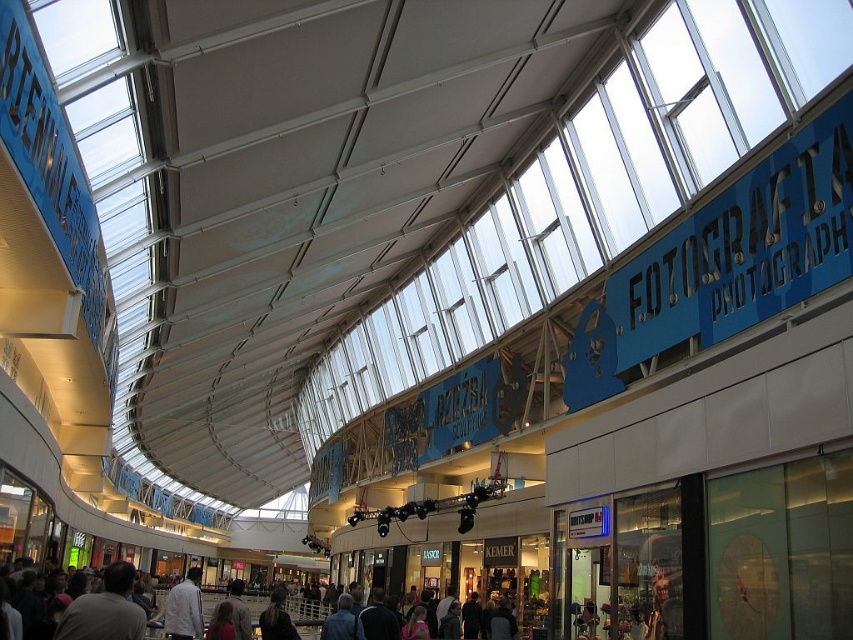
Looking at this image, how much distance is there between light brown leather jacket at center and white shirt at center?

They are 10.56 meters apart.

Does light brown leather jacket at center appear on the right side of white shirt at center?

Indeed, light brown leather jacket at center is positioned on the right side of white shirt at center.

The width and height of the screenshot is (853, 640). In order to click on light brown leather jacket at center in this screenshot , I will do tap(105, 609).

The width and height of the screenshot is (853, 640). Describe the element at coordinates (105, 609) in the screenshot. I see `light brown leather jacket at center` at that location.

Who is positioned more to the right, light brown leather jacket at center or dark brown leather jacket at center?

light brown leather jacket at center is more to the right.

The width and height of the screenshot is (853, 640). I want to click on light brown leather jacket at center, so click(x=105, y=609).

Where is `light brown leather jacket at center`? light brown leather jacket at center is located at coordinates (105, 609).

Is point (164, 609) farther from camera compared to point (270, 602)?

That is False.

Does white shirt at center appear on the right side of dark brown leather jacket at center?

In fact, white shirt at center is to the left of dark brown leather jacket at center.

Does point (195, 630) come farther from viewer compared to point (276, 624)?

Yes, point (195, 630) is farther from viewer.

I want to click on white shirt at center, so tap(184, 609).